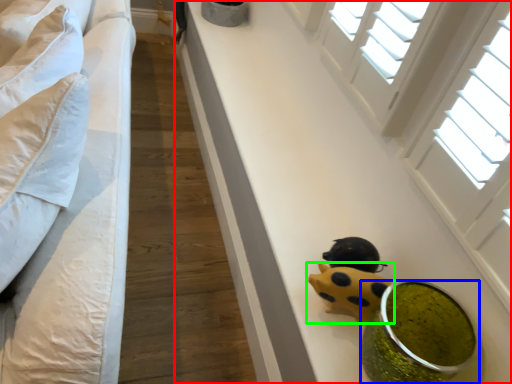
Question: Considering the real-world distances, which object is closest to table (highlighted by a red box)? food (highlighted by a blue box) or toy (highlighted by a green box).

Choices:
 (A) food
 (B) toy

Answer: (A)